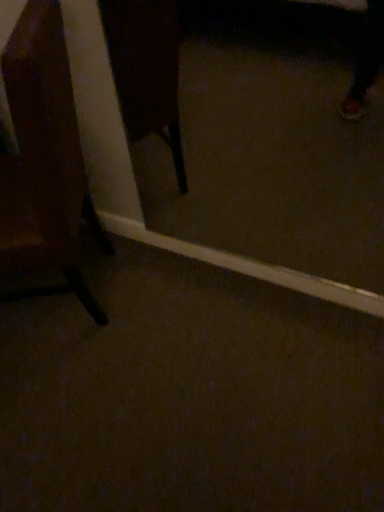
Question: Considering the positions of wooden chair at left and transparent glass door at center in the image, is wooden chair at left taller or shorter than transparent glass door at center?

Choices:
 (A) tall
 (B) short

Answer: (A)

Question: In terms of width, does wooden chair at left look wider or thinner when compared to transparent glass door at center?

Choices:
 (A) wide
 (B) thin

Answer: (A)

Question: Would you say wooden chair at left is inside or outside transparent glass door at center?

Choices:
 (A) outside
 (B) inside

Answer: (A)

Question: Is transparent glass door at center taller or shorter than wooden chair at left?

Choices:
 (A) tall
 (B) short

Answer: (B)

Question: Do you think transparent glass door at center is within wooden chair at left, or outside of it?

Choices:
 (A) outside
 (B) inside

Answer: (A)

Question: Considering their positions, is transparent glass door at center located in front of or behind wooden chair at left?

Choices:
 (A) front
 (B) behind

Answer: (B)

Question: From the image's perspective, is transparent glass door at center located above or below wooden chair at left?

Choices:
 (A) above
 (B) below

Answer: (A)